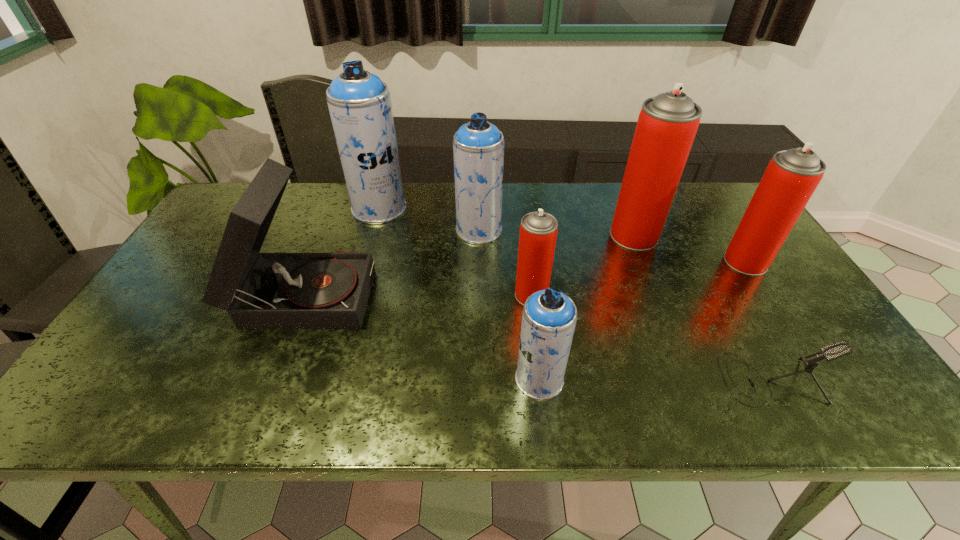
This screenshot has width=960, height=540. In order to click on the second red aerosol can from left to right in this screenshot , I will do `click(667, 124)`.

I want to click on the biggest red aerosol can, so click(x=667, y=124).

Where is `the biggest blue aerosol can`? The width and height of the screenshot is (960, 540). the biggest blue aerosol can is located at coordinates (359, 103).

At what (x,y) coordinates should I click in order to perform the action: click on the leftmost blue aerosol can. Please return your answer as a coordinate pair (x, y). Looking at the image, I should click on (359, 103).

Find the location of a particular element. Image resolution: width=960 pixels, height=540 pixels. the second biggest red aerosol can is located at coordinates (791, 177).

You are a GUI agent. You are given a task and a screenshot of the screen. Output one action in this format:
    pyautogui.click(x=<x>, y=<y>)
    Task: Click on the rightmost red aerosol can
    The image size is (960, 540).
    Given the screenshot: What is the action you would take?
    pyautogui.click(x=791, y=177)

Find the location of a particular element. The height and width of the screenshot is (540, 960). the second aerosol can from left to right is located at coordinates (478, 146).

This screenshot has width=960, height=540. Find the location of `the second blue aerosol can from right to left`. the second blue aerosol can from right to left is located at coordinates (478, 146).

Identify the location of phonograph_record. (258, 290).

I want to click on the smallest red aerosol can, so click(x=538, y=230).